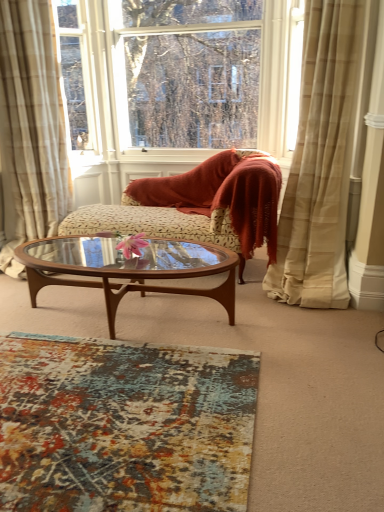
Question: Is brown wood/glass coffee table at center shorter than beige plaid curtain at left, the 2th curtain when ordered from right to left?

Choices:
 (A) yes
 (B) no

Answer: (A)

Question: Is brown wood/glass coffee table at center thinner than beige plaid curtain at left, positioned as the 1th curtain in left-to-right order?

Choices:
 (A) yes
 (B) no

Answer: (A)

Question: Is brown wood/glass coffee table at center at the left side of beige plaid curtain at left, positioned as the 1th curtain in left-to-right order?

Choices:
 (A) yes
 (B) no

Answer: (B)

Question: Is brown wood/glass coffee table at center beside beige plaid curtain at left, the 2th curtain when ordered from right to left?

Choices:
 (A) no
 (B) yes

Answer: (A)

Question: Does brown wood/glass coffee table at center lie in front of beige plaid curtain at left, positioned as the 1th curtain in left-to-right order?

Choices:
 (A) no
 (B) yes

Answer: (B)

Question: From the image's perspective, is beige plaid curtain at right, which appears as the 1th curtain when viewed from the right, positioned above or below transparent glass window at upper center?

Choices:
 (A) above
 (B) below

Answer: (B)

Question: Which is correct: beige plaid curtain at right, marked as the second curtain in a left-to-right arrangement, is inside transparent glass window at upper center, or outside of it?

Choices:
 (A) inside
 (B) outside

Answer: (B)

Question: In terms of size, does beige plaid curtain at right, marked as the second curtain in a left-to-right arrangement, appear bigger or smaller than transparent glass window at upper center?

Choices:
 (A) small
 (B) big

Answer: (B)

Question: Relative to transparent glass window at upper center, is beige plaid curtain at right, which appears as the 1th curtain when viewed from the right, in front or behind?

Choices:
 (A) behind
 (B) front

Answer: (B)

Question: From a real-world perspective, relative to velvet beige chaise at center, is transparent glass window at upper center vertically above or below?

Choices:
 (A) below
 (B) above

Answer: (B)

Question: From the image's perspective, relative to velvet beige chaise at center, is transparent glass window at upper center above or below?

Choices:
 (A) above
 (B) below

Answer: (A)

Question: Considering the positions of transparent glass window at upper center and velvet beige chaise at center in the image, is transparent glass window at upper center bigger or smaller than velvet beige chaise at center?

Choices:
 (A) small
 (B) big

Answer: (A)

Question: From their relative heights in the image, would you say transparent glass window at upper center is taller or shorter than velvet beige chaise at center?

Choices:
 (A) tall
 (B) short

Answer: (A)

Question: From a real-world perspective, relative to beige plaid curtain at left, the 2th curtain when ordered from right to left, is velvet beige chaise at center vertically above or below?

Choices:
 (A) above
 (B) below

Answer: (B)

Question: From the image's perspective, is velvet beige chaise at center positioned above or below beige plaid curtain at left, positioned as the 1th curtain in left-to-right order?

Choices:
 (A) below
 (B) above

Answer: (A)